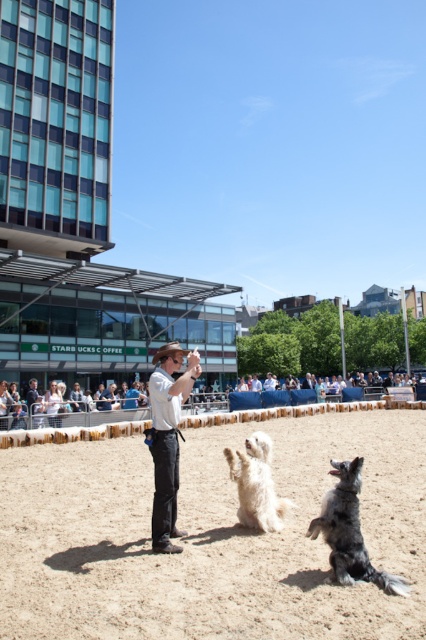
Is point (146, 449) farther from viewer compared to point (344, 534)?

Yes, point (146, 449) is farther from viewer.

Consider the image. Does brown sandy dirt at center have a larger size compared to silver metallic dog at center?

Yes, brown sandy dirt at center is bigger than silver metallic dog at center.

Image resolution: width=426 pixels, height=640 pixels. Describe the element at coordinates (210, 538) in the screenshot. I see `brown sandy dirt at center` at that location.

In order to click on brown sandy dirt at center in this screenshot , I will do (x=210, y=538).

How distant is white cotton shirt at center from silver metallic dog at center?

white cotton shirt at center is 7.14 feet away from silver metallic dog at center.

Which of these two, white cotton shirt at center or silver metallic dog at center, stands taller?

silver metallic dog at center is taller.

Is point (172, 528) positioned behind point (393, 577)?

Yes, it is behind point (393, 577).

Locate an element on the screen. The height and width of the screenshot is (640, 426). white cotton shirt at center is located at coordinates (167, 436).

Is the position of brown sandy dirt at center more distant than that of white fluffy dog at center?

No.

Which is behind, point (66, 620) or point (268, 444)?

The point (268, 444) is more distant.

Is point (17, 548) less distant than point (256, 520)?

Yes, it is.

Find the location of a particular element. The height and width of the screenshot is (640, 426). brown sandy dirt at center is located at coordinates (210, 538).